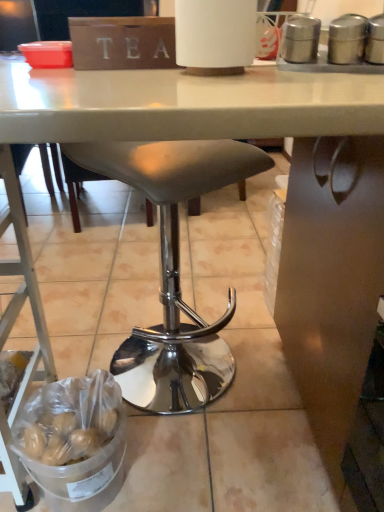
Question: Is metallic silver ladder at lower left to the right of silver metallic canisters at upper right from the viewer's perspective?

Choices:
 (A) yes
 (B) no

Answer: (B)

Question: Can you confirm if metallic silver ladder at lower left is taller than silver metallic canisters at upper right?

Choices:
 (A) no
 (B) yes

Answer: (B)

Question: From a real-world perspective, is metallic silver ladder at lower left physically above silver metallic canisters at upper right?

Choices:
 (A) yes
 (B) no

Answer: (B)

Question: Does metallic silver ladder at lower left come behind silver metallic canisters at upper right?

Choices:
 (A) no
 (B) yes

Answer: (A)

Question: Is metallic silver ladder at lower left not inside silver metallic canisters at upper right?

Choices:
 (A) no
 (B) yes

Answer: (B)

Question: Is metallic silver ladder at lower left in contact with silver metallic canisters at upper right?

Choices:
 (A) no
 (B) yes

Answer: (A)

Question: Are matte gray stool at center and silver metallic canisters at upper right far apart?

Choices:
 (A) no
 (B) yes

Answer: (A)

Question: Can you confirm if matte gray stool at center is positioned to the right of silver metallic canisters at upper right?

Choices:
 (A) no
 (B) yes

Answer: (A)

Question: Is matte gray stool at center positioned with its back to silver metallic canisters at upper right?

Choices:
 (A) no
 (B) yes

Answer: (A)

Question: Is matte gray stool at center at the left side of silver metallic canisters at upper right?

Choices:
 (A) yes
 (B) no

Answer: (A)

Question: Does matte gray stool at center have a lesser width compared to silver metallic canisters at upper right?

Choices:
 (A) yes
 (B) no

Answer: (B)

Question: Is matte gray stool at center completely or partially outside of silver metallic canisters at upper right?

Choices:
 (A) no
 (B) yes

Answer: (B)

Question: Is silver metallic canisters at upper right facing away from metallic silver ladder at lower left?

Choices:
 (A) no
 (B) yes

Answer: (A)